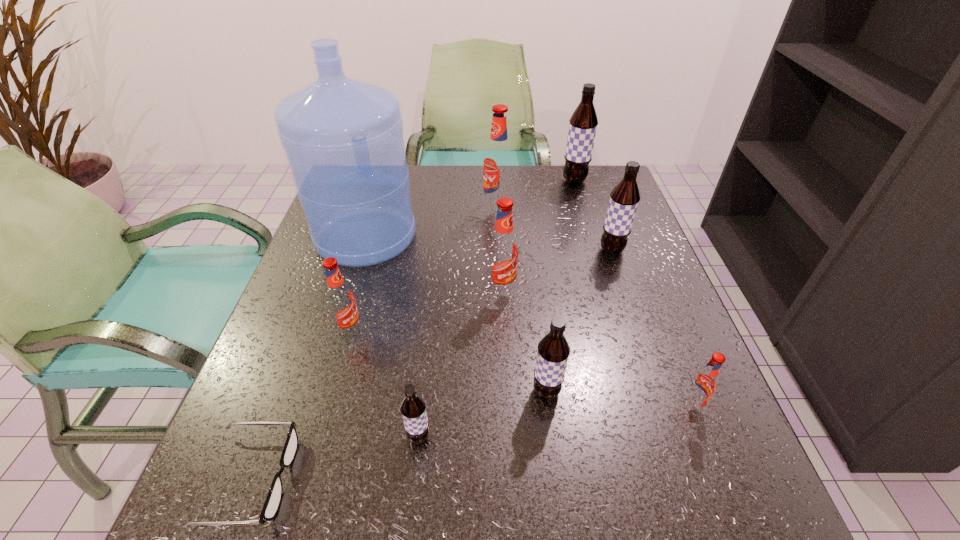
This screenshot has width=960, height=540. In order to click on vacant point located between the spectacles and the tallest object in this screenshot , I will do `click(308, 357)`.

This screenshot has width=960, height=540. Find the location of `vacant region between the third nearest brown root beer and the black spectacles`. vacant region between the third nearest brown root beer and the black spectacles is located at coordinates (431, 364).

Identify the location of vacant area that lies between the smallest brown root beer and the water jug. Image resolution: width=960 pixels, height=540 pixels. (393, 336).

Image resolution: width=960 pixels, height=540 pixels. Find the location of `free point between the seventh nearest root beer and the second nearest red root beer`. free point between the seventh nearest root beer and the second nearest red root beer is located at coordinates (423, 269).

Identify the location of vacant region between the third nearest red root beer and the tallest object. (434, 264).

In order to click on empty space between the fifth farthest root beer and the second farthest brown root beer in this screenshot , I will do `click(481, 291)`.

The width and height of the screenshot is (960, 540). Find the location of `free space that is in between the farthest object and the farthest red root beer`. free space that is in between the farthest object and the farthest red root beer is located at coordinates (536, 194).

Identify the location of object that is the fifth closest to the biggest red root beer. Image resolution: width=960 pixels, height=540 pixels. (340, 299).

Choose which object is the second nearest neighbor to the leftmost root beer. Please provide its 2D coordinates. Your answer should be formatted as a tuple, i.e. [(x, y)], where the tuple contains the x and y coordinates of a point satisfying the conditions above.

[(273, 500)]

Locate which root beer is the fourth closest to the second farthest brown root beer. Please provide its 2D coordinates. Your answer should be formatted as a tuple, i.e. [(x, y)], where the tuple contains the x and y coordinates of a point satisfying the conditions above.

[(553, 350)]